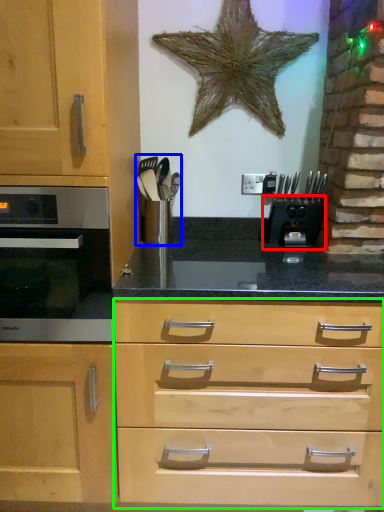
Question: Estimate the real-world distances between objects in this image. Which object is farther from coffee machine (highlighted by a red box), appliance (highlighted by a blue box) or drawer (highlighted by a green box)?

Choices:
 (A) appliance
 (B) drawer

Answer: (B)